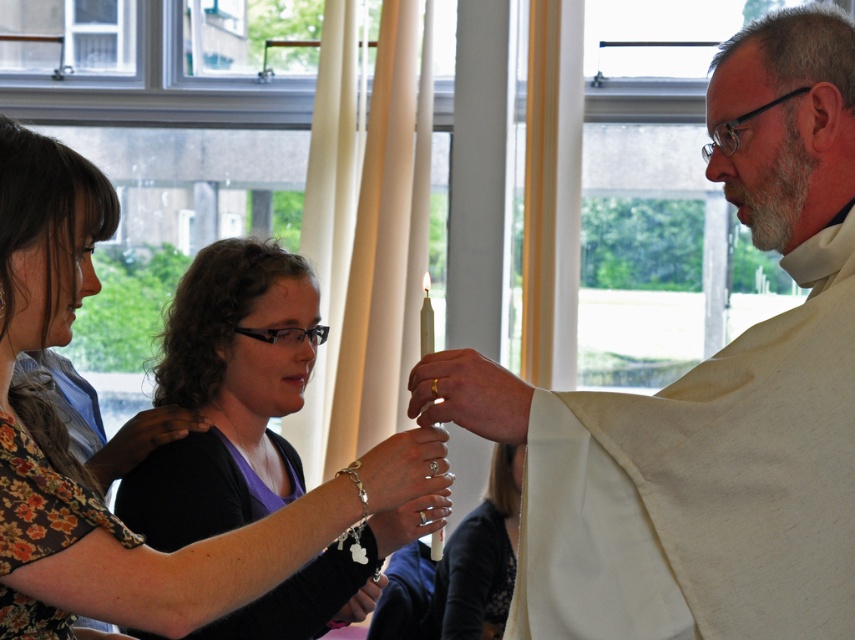
Which is more to the right, white clothed man at center or silver metallic bracelet at lower center?

From the viewer's perspective, white clothed man at center appears more on the right side.

Can you confirm if white clothed man at center is positioned below silver metallic bracelet at lower center?

Incorrect, white clothed man at center is not positioned below silver metallic bracelet at lower center.

Which is in front, point (791, 540) or point (181, 499)?

Positioned in front is point (791, 540).

Locate an element on the screen. This screenshot has height=640, width=855. white clothed man at center is located at coordinates (708, 400).

Who is positioned more to the left, white clothed man at center or white matte robe at center?

From the viewer's perspective, white matte robe at center appears more on the left side.

The height and width of the screenshot is (640, 855). What do you see at coordinates (708, 400) in the screenshot?
I see `white clothed man at center` at bounding box center [708, 400].

Between point (561, 417) and point (470, 600), which one is positioned in front?

Point (561, 417)

Find the location of a particular element. The width and height of the screenshot is (855, 640). white clothed man at center is located at coordinates (708, 400).

Does white clothed man at center have a greater width compared to matte black shirt at center?

Yes.

Describe the element at coordinates (708, 400) in the screenshot. I see `white clothed man at center` at that location.

Where is `white clothed man at center`? This screenshot has width=855, height=640. white clothed man at center is located at coordinates pos(708,400).